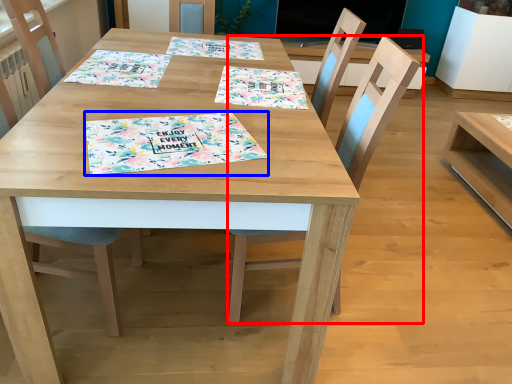
Question: Which object appears farthest to the camera in this image, chair (highlighted by a red box) or place mat (highlighted by a blue box)?

Choices:
 (A) chair
 (B) place mat

Answer: (A)